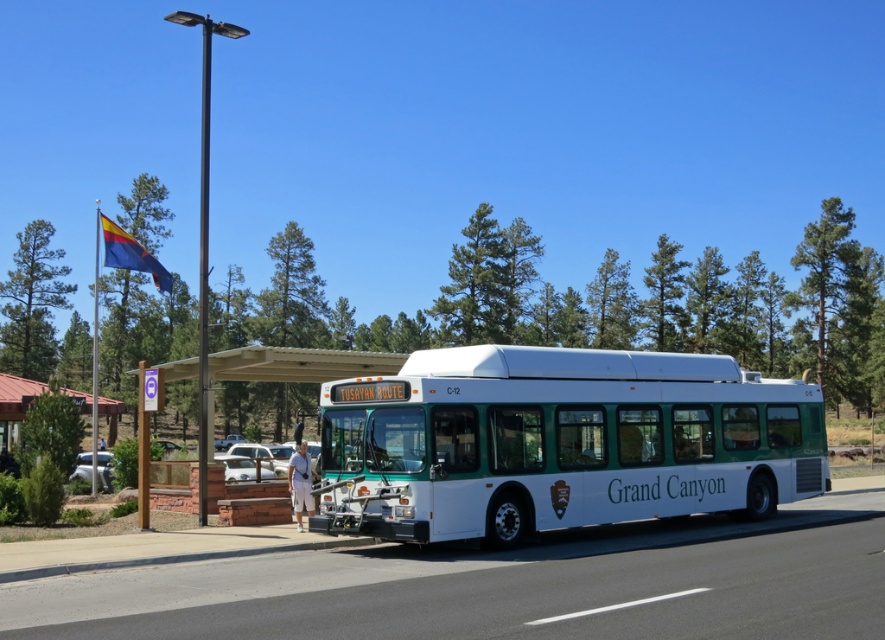
You are at the Grand Canyon transportation hub and need to locate the metallic red bus stop at left. According to the scene description, where would you find it in relation to the TUSAYAN ROUTE bus?

The metallic red bus stop at left is located to the left side of the scene, positioned at coordinates approximately 0.637 on the x and 0.018 on the y axis, which places it to the left of the TUSAYAN ROUTE bus parked on the right side of the road.

You are a tourist at the Grand Canyon transportation hub. You see the wooden bus stop at center and the metallic red bus stop at left. Which one is narrower?

The wooden bus stop at center is thinner than the metallic red bus stop at left, so the wooden bus stop at center is narrower.